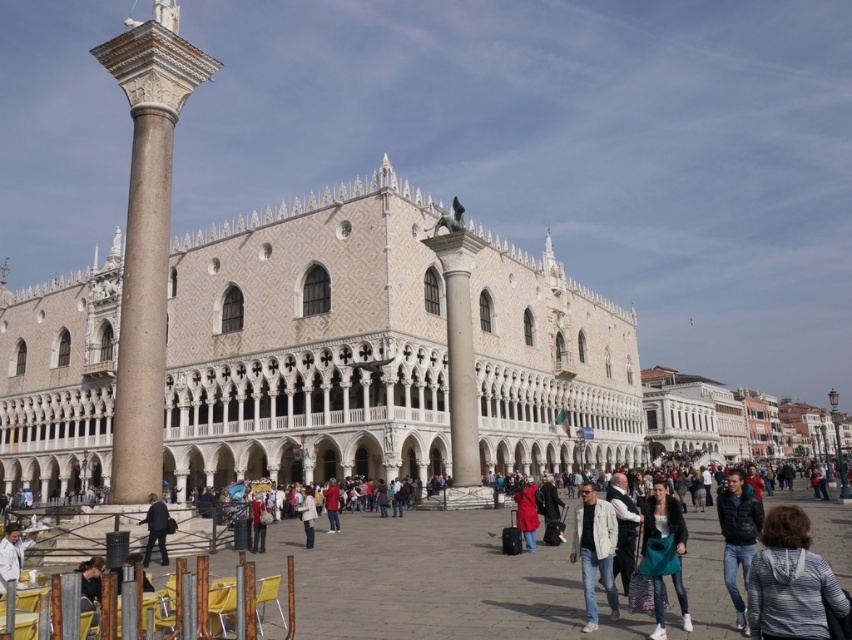
You are a photographer in the square and want to capture both the dark gray suit at lower left and the white matte jacket at center in a single shot. Which subject should you frame first to ensure both are in the photo?

You should frame the dark gray suit at lower left first since it is positioned on the left side of the white matte jacket at center, ensuring both are included in the shot.